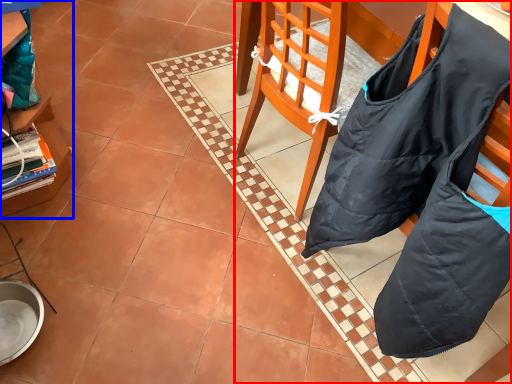
Question: Which of the following is the closest to the observer, chair (highlighted by a red box) or cabinetry (highlighted by a blue box)?

Choices:
 (A) chair
 (B) cabinetry

Answer: (A)